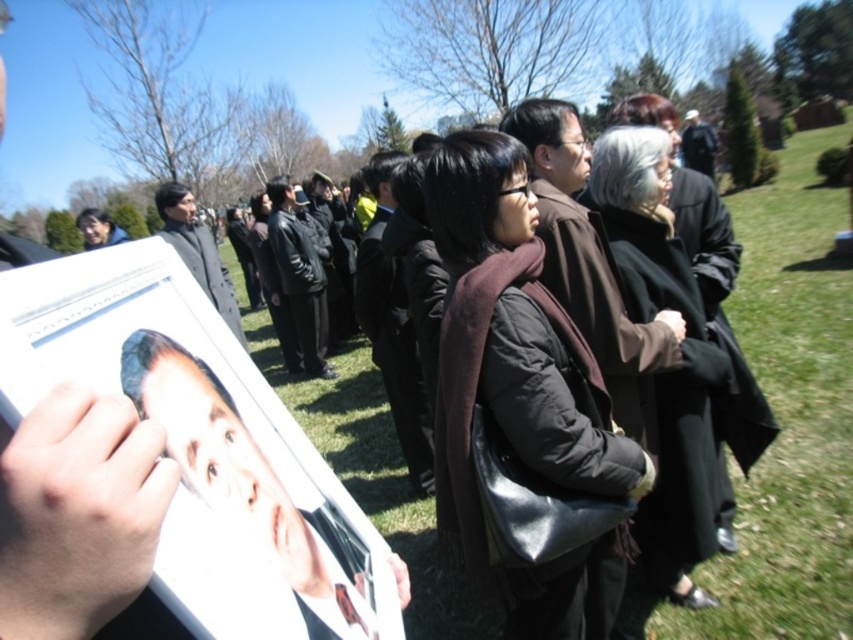
Question: Is dark brown wool scarf at center to the left of black wool coat at center from the viewer's perspective?

Choices:
 (A) no
 (B) yes

Answer: (B)

Question: Considering the relative positions of dark brown wool scarf at center and black wool coat at center in the image provided, where is dark brown wool scarf at center located with respect to black wool coat at center?

Choices:
 (A) below
 (B) above

Answer: (A)

Question: Among these points, which one is nearest to the camera?

Choices:
 (A) (537, 248)
 (B) (701, 545)

Answer: (A)

Question: Is dark brown wool scarf at center positioned before black wool coat at center?

Choices:
 (A) yes
 (B) no

Answer: (A)